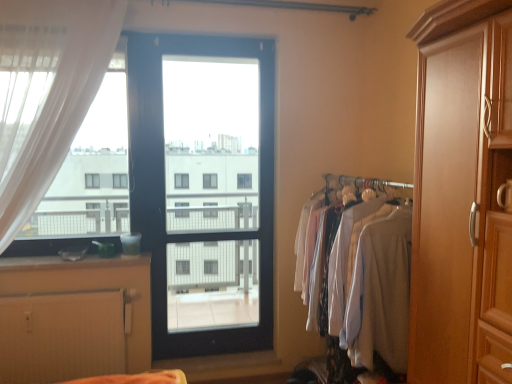
Question: From a real-world perspective, is black glass door at center physically below white textured radiator at lower left?

Choices:
 (A) no
 (B) yes

Answer: (A)

Question: From a real-world perspective, is black glass door at center on white textured radiator at lower left?

Choices:
 (A) yes
 (B) no

Answer: (A)

Question: Considering the relative sizes of black glass door at center and white textured radiator at lower left in the image provided, is black glass door at center thinner than white textured radiator at lower left?

Choices:
 (A) yes
 (B) no

Answer: (A)

Question: Is black glass door at center behind white textured radiator at lower left?

Choices:
 (A) yes
 (B) no

Answer: (A)

Question: Is white textured radiator at lower left at the back of black glass door at center?

Choices:
 (A) yes
 (B) no

Answer: (B)

Question: Looking at the image, does smooth wooden surface at lower left seem bigger or smaller compared to white textured radiator at lower left?

Choices:
 (A) big
 (B) small

Answer: (B)

Question: From a real-world perspective, is smooth wooden surface at lower left positioned above or below white textured radiator at lower left?

Choices:
 (A) above
 (B) below

Answer: (A)

Question: Based on their positions, is smooth wooden surface at lower left located to the left or right of white textured radiator at lower left?

Choices:
 (A) right
 (B) left

Answer: (B)

Question: From the image's perspective, is smooth wooden surface at lower left positioned above or below white textured radiator at lower left?

Choices:
 (A) above
 (B) below

Answer: (A)

Question: Would you say light gray fabric shirts at right is to the left or to the right of smooth wooden surface at lower left in the picture?

Choices:
 (A) right
 (B) left

Answer: (A)

Question: In the image, is light gray fabric shirts at right positioned in front of or behind smooth wooden surface at lower left?

Choices:
 (A) behind
 (B) front

Answer: (B)

Question: From a real-world perspective, is light gray fabric shirts at right physically located above or below smooth wooden surface at lower left?

Choices:
 (A) below
 (B) above

Answer: (A)

Question: From the image's perspective, is light gray fabric shirts at right positioned above or below smooth wooden surface at lower left?

Choices:
 (A) below
 (B) above

Answer: (A)

Question: Is point (116, 264) closer or farther from the camera than point (347, 205)?

Choices:
 (A) farther
 (B) closer

Answer: (A)

Question: Considering the positions of smooth wooden surface at lower left and light gray fabric shirts at right in the image, is smooth wooden surface at lower left taller or shorter than light gray fabric shirts at right?

Choices:
 (A) tall
 (B) short

Answer: (B)